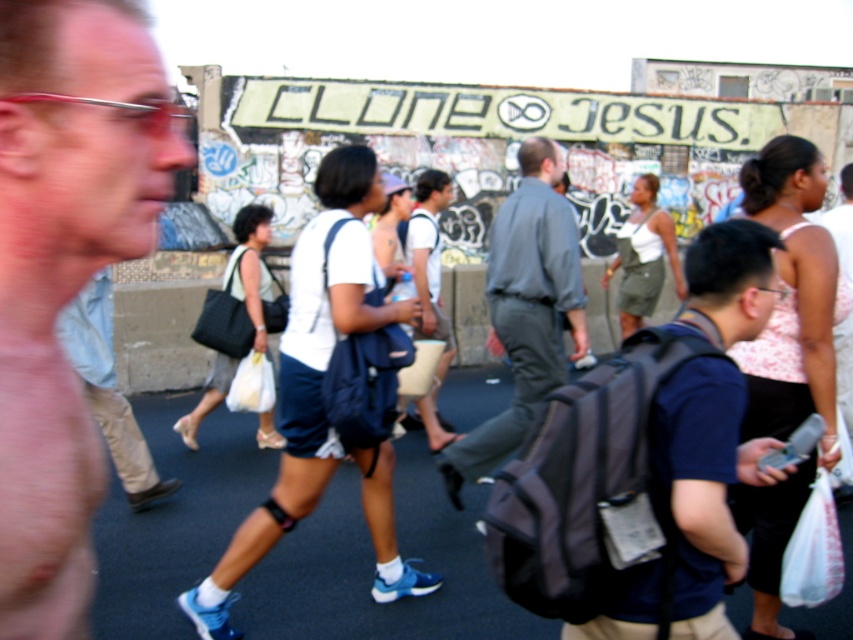
You are a photographer standing in front of the urban scene described. You want to take a photo focusing on the matte blue shorts at center and the black asphalt at center. Which object will appear larger in your photo?

The matte blue shorts at center will appear larger in the photo because it is closer to the viewer than the black asphalt at center.

You are standing at the origin point of the coordinate system in this urban scene. You need to walk to the black asphalt at center. What are the coordinates you should head towards?

The coordinates for the black asphalt at center are 0.887 in the x direction and 0.438 in the y direction. You should head towards those coordinates.